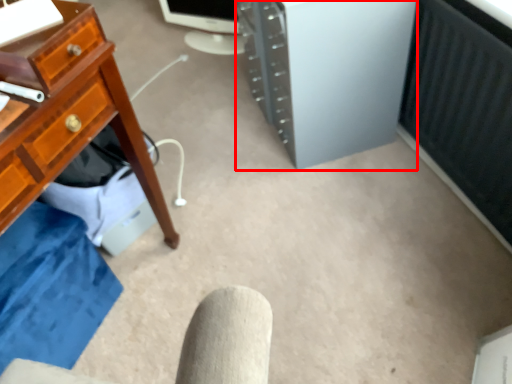
Question: From the image's perspective, where is computer tower (annotated by the red box) located relative to desktop computer?

Choices:
 (A) below
 (B) above

Answer: (A)